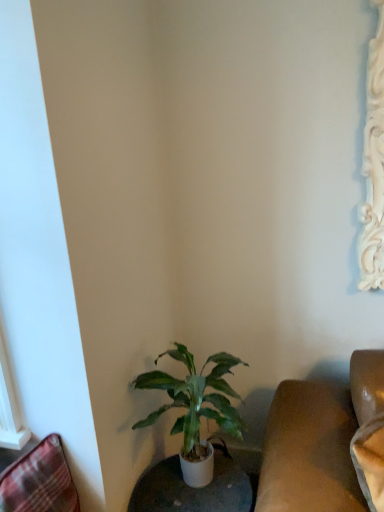
Locate an element on the screen. Image resolution: width=384 pixels, height=512 pixels. plaid fabric swivel chair at lower left is located at coordinates (39, 481).

Find the location of a particular element. This screenshot has height=512, width=384. plaid fabric swivel chair at lower left is located at coordinates (39, 481).

From a real-world perspective, is plaid fabric swivel chair at lower left beneath green matte plant at lower center?

Indeed, from a real-world perspective, plaid fabric swivel chair at lower left is positioned beneath green matte plant at lower center.

Where is `houseplant that is above the plaid fabric swivel chair at lower left (from the image's perspective)`? houseplant that is above the plaid fabric swivel chair at lower left (from the image's perspective) is located at coordinates (195, 399).

From the image's perspective, is plaid fabric swivel chair at lower left over green matte plant at lower center?

No, from the image's perspective, plaid fabric swivel chair at lower left is not above green matte plant at lower center.

Is green matte plant at lower center positioned behind white glossy round table at lower center?

No.

Is point (216, 385) positioned behind point (216, 463)?

No, (216, 385) is in front of (216, 463).

Considering the sizes of objects green matte plant at lower center and white glossy round table at lower center in the image provided, who is thinner, green matte plant at lower center or white glossy round table at lower center?

white glossy round table at lower center.

From the image's perspective, is green matte plant at lower center below white glossy round table at lower center?

No.

Which is behind, green matte plant at lower center or plaid fabric swivel chair at lower left?

green matte plant at lower center is further from the camera.

From the image's perspective, who appears lower, green matte plant at lower center or plaid fabric swivel chair at lower left?

plaid fabric swivel chair at lower left.

Based on the photo, would you say plaid fabric swivel chair at lower left is part of green matte plant at lower center's contents?

Definitely not — plaid fabric swivel chair at lower left is not inside green matte plant at lower center.

Which object is positioned more to the right, green matte plant at lower center or plaid fabric swivel chair at lower left?

green matte plant at lower center is more to the right.

In the scene shown: Is there a large distance between white glossy round table at lower center and green matte plant at lower center?

white glossy round table at lower center is near green matte plant at lower center, not far away.

Where is `round table below the green matte plant at lower center (from the image's perspective)`? The image size is (384, 512). round table below the green matte plant at lower center (from the image's perspective) is located at coordinates (199, 488).

Is white glossy round table at lower center aimed at green matte plant at lower center?

No, white glossy round table at lower center does not turn towards green matte plant at lower center.

Which of these two, white glossy round table at lower center or green matte plant at lower center, stands shorter?

With less height is white glossy round table at lower center.

In the image, there is a white glossy round table at lower center. Where is `swivel chair above it (from the image's perspective)`? swivel chair above it (from the image's perspective) is located at coordinates (39, 481).

Between white glossy round table at lower center and plaid fabric swivel chair at lower left, which one appears on the right side from the viewer's perspective?

white glossy round table at lower center.

From a real-world perspective, who is located higher, white glossy round table at lower center or plaid fabric swivel chair at lower left?

plaid fabric swivel chair at lower left, from a real-world perspective.

Is plaid fabric swivel chair at lower left far from white glossy round table at lower center?

That's not correct — plaid fabric swivel chair at lower left is a little close to white glossy round table at lower center.

Considering the relative sizes of plaid fabric swivel chair at lower left and white glossy round table at lower center in the image provided, is plaid fabric swivel chair at lower left wider than white glossy round table at lower center?

No.

How different are the orientations of plaid fabric swivel chair at lower left and white glossy round table at lower center in degrees?

66 degrees.

Based on the photo, from the image's perspective, does plaid fabric swivel chair at lower left appear lower than white glossy round table at lower center?

Actually, plaid fabric swivel chair at lower left appears above white glossy round table at lower center in the image.

Find the location of a particular element. swivel chair lying in front of the green matte plant at lower center is located at coordinates (39, 481).

The image size is (384, 512). In order to click on houseplant on the right of the white glossy round table at lower center in this screenshot , I will do `click(195, 399)`.

Considering their positions, is white glossy round table at lower center positioned further to green matte plant at lower center than plaid fabric swivel chair at lower left?

plaid fabric swivel chair at lower left is further to green matte plant at lower center.

Based on their spatial positions, is green matte plant at lower center or plaid fabric swivel chair at lower left closer to white glossy round table at lower center?

The object closer to white glossy round table at lower center is green matte plant at lower center.

From the image, which object appears to be farther from plaid fabric swivel chair at lower left, green matte plant at lower center or white glossy round table at lower center?

Among the two, white glossy round table at lower center is located further to plaid fabric swivel chair at lower left.

From the image, which object appears to be nearer to white glossy round table at lower center, plaid fabric swivel chair at lower left or green matte plant at lower center?

green matte plant at lower center is positioned closer to the anchor white glossy round table at lower center.

Looking at this image, estimate the real-world distances between objects in this image. Which object is closer to plaid fabric swivel chair at lower left, white glossy round table at lower center or green matte plant at lower center?

green matte plant at lower center lies closer to plaid fabric swivel chair at lower left than the other object.

When comparing their distances from green matte plant at lower center, does plaid fabric swivel chair at lower left or white glossy round table at lower center seem further?

The object further to green matte plant at lower center is plaid fabric swivel chair at lower left.

The height and width of the screenshot is (512, 384). I want to click on round table between plaid fabric swivel chair at lower left and green matte plant at lower center in the horizontal direction, so click(199, 488).